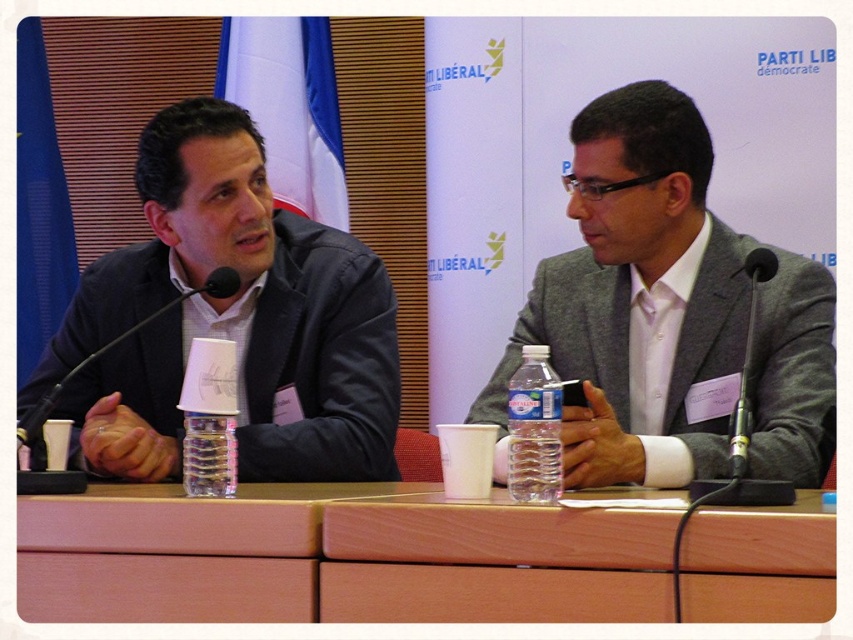
Between point (65, 552) and point (616, 182), which one is positioned in front?

Point (65, 552) is in front.

Is wooden table at center thinner than gray fabric suit at center?

Incorrect, wooden table at center's width is not less than gray fabric suit at center's.

Is point (645, 576) in front of point (654, 372)?

Yes, it is in front of point (654, 372).

Identify the location of wooden table at center. The width and height of the screenshot is (853, 640). (338, 557).

Is point (146, 355) behind point (16, 440)?

Yes, point (146, 355) is behind point (16, 440).

Does matte black suit at left appear on the left side of black matte microphone at left?

No, matte black suit at left is not to the left of black matte microphone at left.

Is point (270, 273) positioned in front of point (225, 284)?

No, it is not.

Find the location of `matte black suit at left`. matte black suit at left is located at coordinates (229, 320).

Is clear plastic bottle at center further to camera compared to black matte microphone at left?

No, clear plastic bottle at center is closer to the viewer.

You are a GUI agent. You are given a task and a screenshot of the screen. Output one action in this format:
    pyautogui.click(x=<x>, y=<y>)
    Task: Click on the clear plastic bottle at center
    
    Given the screenshot: What is the action you would take?
    pyautogui.click(x=534, y=429)